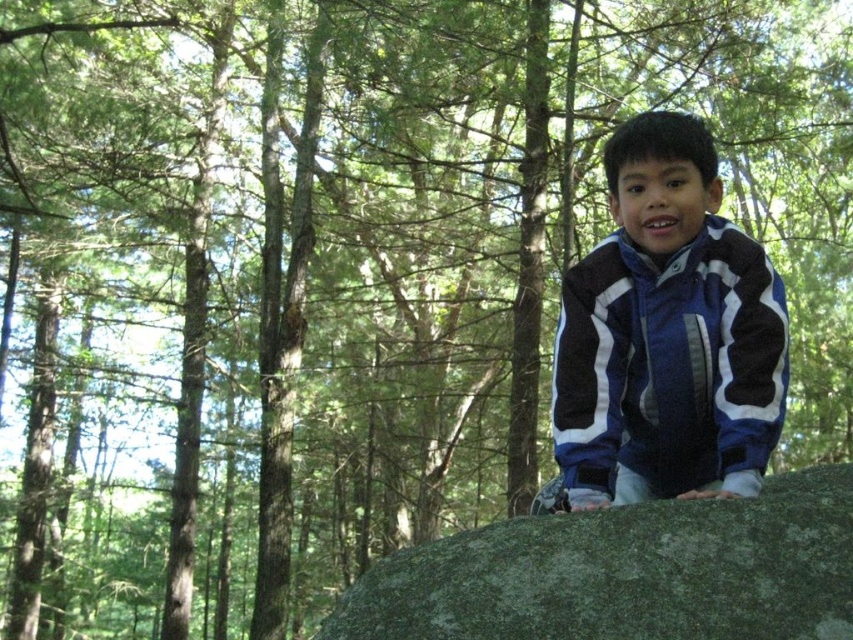
Question: Which point is farther to the camera?

Choices:
 (A) (779, 634)
 (B) (618, 328)

Answer: (B)

Question: Which point appears farthest from the camera in this image?

Choices:
 (A) (641, 529)
 (B) (625, 154)

Answer: (B)

Question: Does blue fleece jacket at center have a smaller size compared to green mossy boulder at center?

Choices:
 (A) yes
 (B) no

Answer: (A)

Question: Is blue fleece jacket at center to the right of green mossy boulder at center from the viewer's perspective?

Choices:
 (A) yes
 (B) no

Answer: (B)

Question: Which point appears farthest from the camera in this image?

Choices:
 (A) (606, 280)
 (B) (582, 524)

Answer: (A)

Question: Is blue fleece jacket at center closer to camera compared to green mossy boulder at center?

Choices:
 (A) yes
 (B) no

Answer: (B)